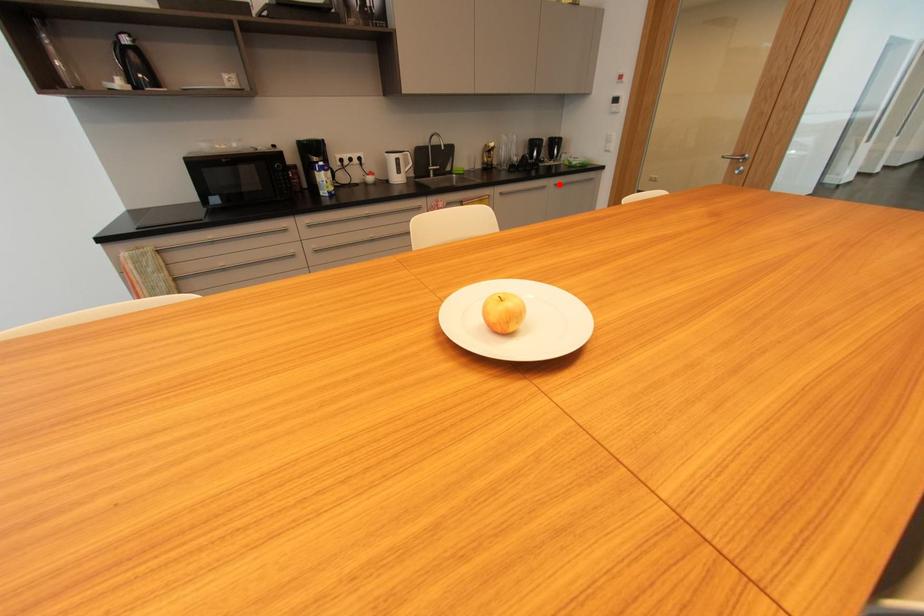
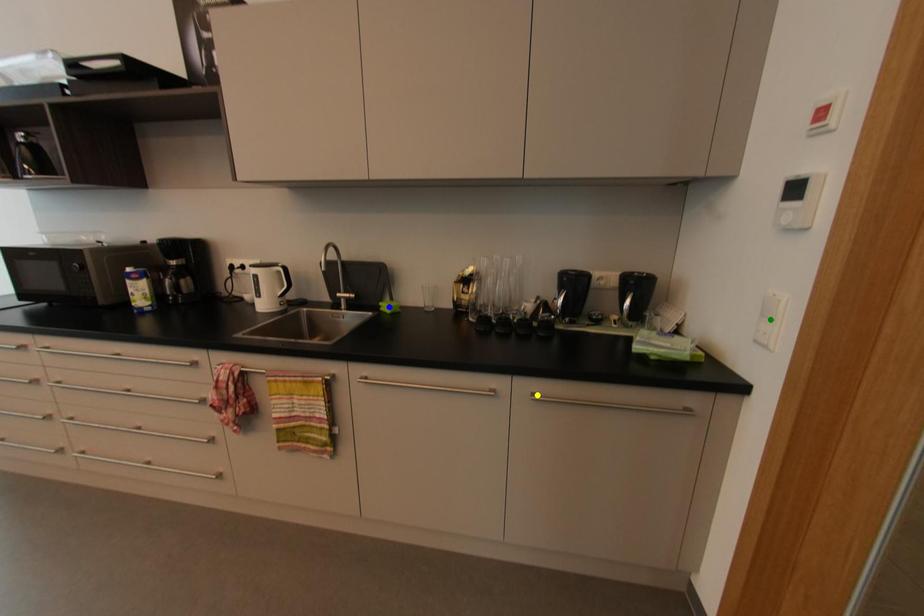
Question: I am providing you with two images of the same scene from different viewpoints. A red point is marked on the first image. You are given multiple points on the second image. In image 2, which mark is for the same physical point as the one in image 1?

Choices:
 (A) green point
 (B) blue point
 (C) yellow point

Answer: (C)